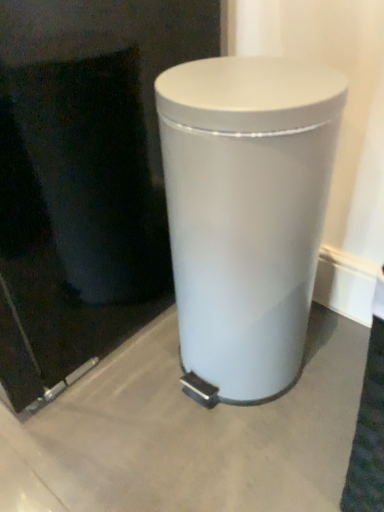
In order to face white matte waste container at center, should I rotate leftwards or rightwards?

Rotate right and turn 6.917 degrees.

This screenshot has height=512, width=384. Find the location of `white matte waste container at center`. white matte waste container at center is located at coordinates (246, 212).

The image size is (384, 512). Describe the element at coordinates (246, 212) in the screenshot. I see `white matte waste container at center` at that location.

In order to click on white matte waste container at center in this screenshot , I will do `click(246, 212)`.